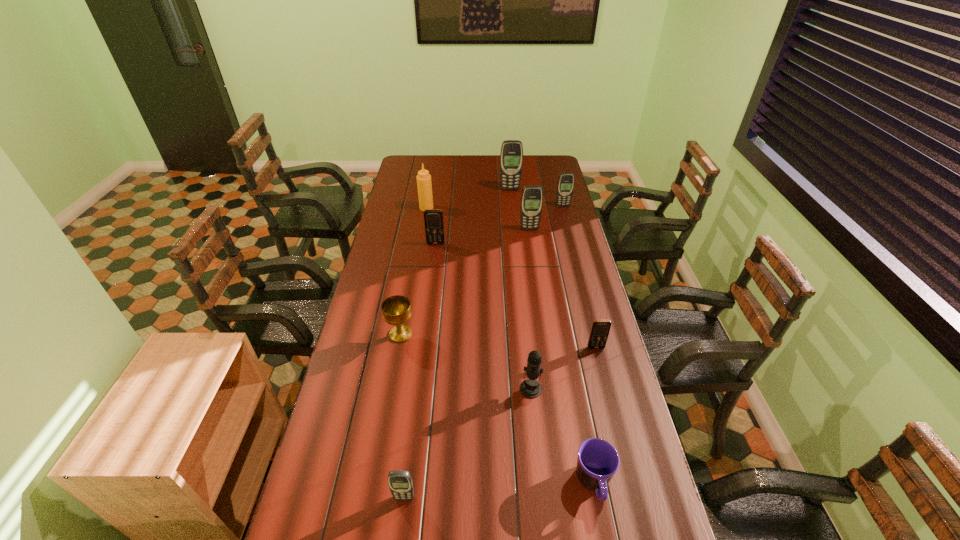
Find the location of a particular element. The width and height of the screenshot is (960, 540). vacant space located on the screen of the third farthest cellular telephone is located at coordinates (534, 260).

This screenshot has width=960, height=540. Identify the location of free space located 0.210m on the screen of the second farthest gray cellular telephone. (569, 231).

You are a GUI agent. You are given a task and a screenshot of the screen. Output one action in this format:
    pyautogui.click(x=<x>, y=<y>)
    Task: Click on the vacant space located on the screen of the left orange cellular telephone
    The image size is (960, 540).
    Given the screenshot: What is the action you would take?
    pyautogui.click(x=433, y=268)

Where is `free space located 0.320m on the front of the microphone`? free space located 0.320m on the front of the microphone is located at coordinates (543, 507).

Image resolution: width=960 pixels, height=540 pixels. Identify the location of vacant space located on the back of the fifth nearest object. (406, 305).

Locate an element on the screen. free space located on the screen of the seventh farthest object is located at coordinates tap(610, 402).

Locate an element on the screen. free region located 0.090m on the screen of the smallest gray cellular telephone is located at coordinates (399, 539).

This screenshot has height=540, width=960. What are the coordinates of `condiment that is at the left edge` in the screenshot? It's located at (424, 184).

You are a GUI agent. You are given a task and a screenshot of the screen. Output one action in this format:
    pyautogui.click(x=<x>, y=<y>)
    Task: Click on the chalice that is at the left edge
    This screenshot has height=540, width=960.
    Given the screenshot: What is the action you would take?
    pyautogui.click(x=396, y=310)

Find the location of `mug situated at the right edge`. mug situated at the right edge is located at coordinates (598, 461).